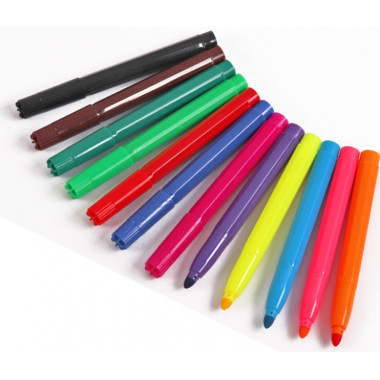
You are a GUI agent. You are given a task and a screenshot of the screen. Output one action in this format:
    pyautogui.click(x=<x>, y=<y>)
    Task: Click on the markers without caps
    
    Given the screenshot: What is the action you would take?
    click(x=350, y=276), click(x=322, y=273), click(x=292, y=256), click(x=255, y=245), click(x=231, y=230)